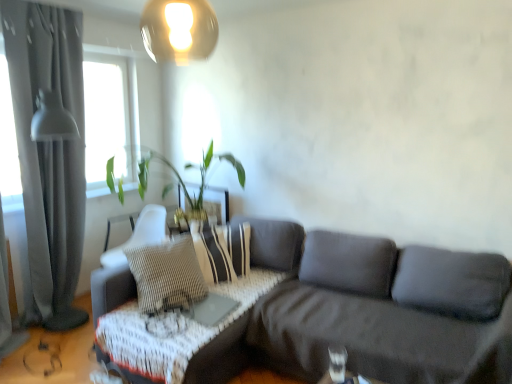
Question: Considering the relative sizes of wooden textured table at lower center, which ranks as the 1th table in right-to-left order, and gold metallic lampshade at upper center in the image provided, is wooden textured table at lower center, which ranks as the 1th table in right-to-left order, bigger than gold metallic lampshade at upper center?

Choices:
 (A) yes
 (B) no

Answer: (B)

Question: From a real-world perspective, is wooden textured table at lower center, which is counted as the first table, starting from the front, under gold metallic lampshade at upper center?

Choices:
 (A) yes
 (B) no

Answer: (A)

Question: Is wooden textured table at lower center, the second table in the left-to-right sequence, thinner than gold metallic lampshade at upper center?

Choices:
 (A) yes
 (B) no

Answer: (A)

Question: From the image's perspective, does wooden textured table at lower center, acting as the 2th table starting from the back, appear higher than gold metallic lampshade at upper center?

Choices:
 (A) yes
 (B) no

Answer: (B)

Question: Is wooden textured table at lower center, which ranks as the 1th table in right-to-left order, taller than gold metallic lampshade at upper center?

Choices:
 (A) yes
 (B) no

Answer: (B)

Question: Would you consider wooden textured table at lower center, the second table in the left-to-right sequence, to be distant from gold metallic lampshade at upper center?

Choices:
 (A) yes
 (B) no

Answer: (A)

Question: Is gold metallic lampshade at upper center next to green leafy plant at upper left?

Choices:
 (A) yes
 (B) no

Answer: (B)

Question: From the image's perspective, would you say gold metallic lampshade at upper center is shown under green leafy plant at upper left?

Choices:
 (A) no
 (B) yes

Answer: (A)

Question: From the image's perspective, is gold metallic lampshade at upper center on top of green leafy plant at upper left?

Choices:
 (A) no
 (B) yes

Answer: (B)

Question: Does gold metallic lampshade at upper center appear on the left side of green leafy plant at upper left?

Choices:
 (A) no
 (B) yes

Answer: (A)

Question: Considering the relative sizes of gold metallic lampshade at upper center and green leafy plant at upper left in the image provided, is gold metallic lampshade at upper center thinner than green leafy plant at upper left?

Choices:
 (A) yes
 (B) no

Answer: (A)

Question: Is gold metallic lampshade at upper center to the right of green leafy plant at upper left from the viewer's perspective?

Choices:
 (A) yes
 (B) no

Answer: (A)

Question: Can we say woven fabric armchair at center lies outside striped fabric pillow at center?

Choices:
 (A) yes
 (B) no

Answer: (A)